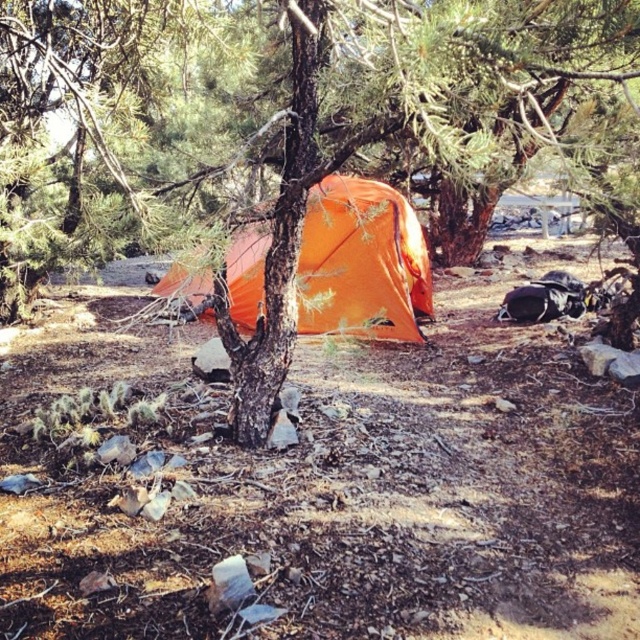
Is smooth bark tree at center shorter than orange fabric tent at center?

Yes.

From the picture: Is smooth bark tree at center smaller than orange fabric tent at center?

Correct, smooth bark tree at center occupies less space than orange fabric tent at center.

Locate an element on the screen. smooth bark tree at center is located at coordinates (304, 148).